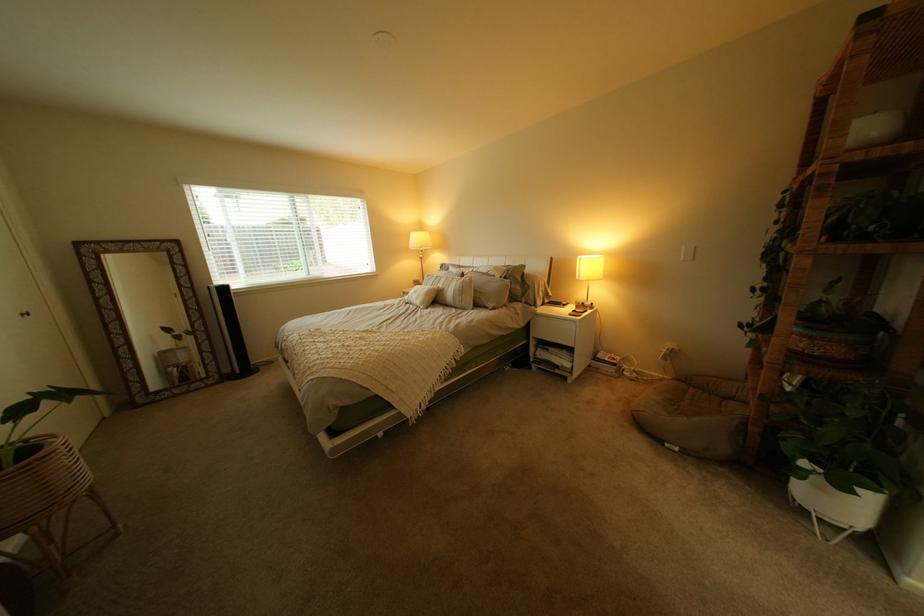
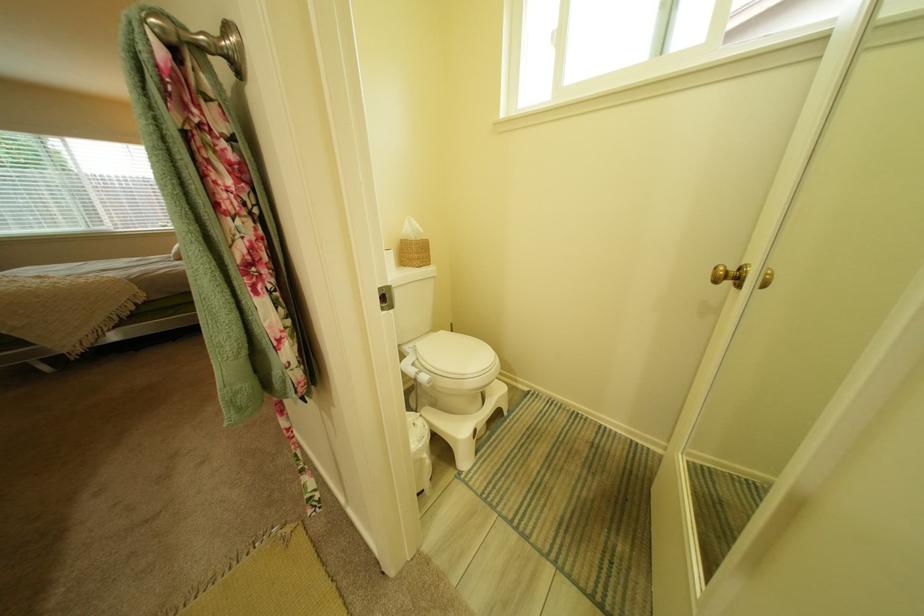
Question: In a continuous first-person perspective shot, in which direction is the camera moving?

Choices:
 (A) Left
 (B) Right
 (C) Forward
 (D) Backward

Answer: (B)